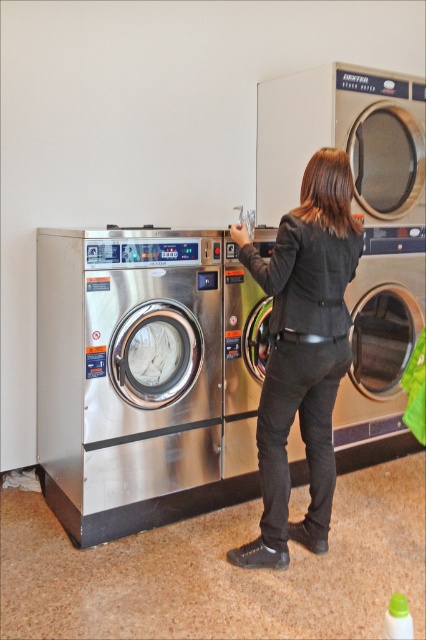
You are standing at the point labeled point (95, 256) and want to move to the point labeled point (394, 296). Which direction should you walk to get closer to your destination?

You should walk downward because point (394, 296) is located below point (95, 256) in the image.

You are a customer at the laundry facility and want to retrieve your jacket. The black leather jacket at center is currently hanging on a hook above the stainless steel washing machine at left. Can you reach it without moving the jacket or the washing machine?

The stainless steel washing machine at left is located below the black leather jacket at center, so you can reach the jacket by simply extending your arm upwards from the position near the washing machine.